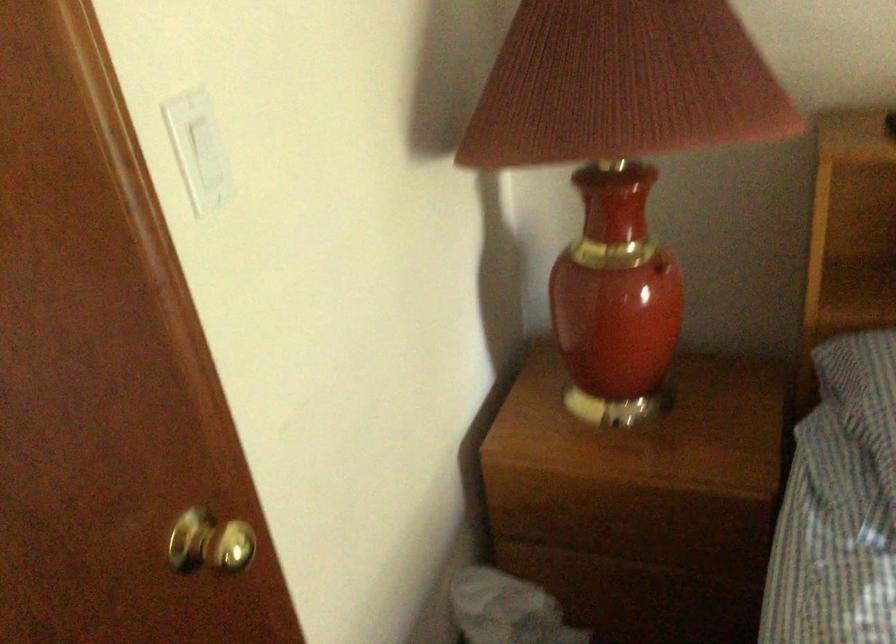
The image size is (896, 644). What do you see at coordinates (661, 267) in the screenshot?
I see `the red lamp switch` at bounding box center [661, 267].